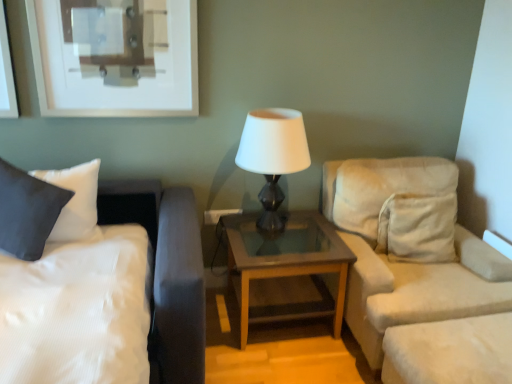
Question: From the image's perspective, is white glossy lamp at center located above or below beige fabric studio couch at right?

Choices:
 (A) below
 (B) above

Answer: (B)

Question: In terms of size, does white glossy lamp at center appear bigger or smaller than beige fabric studio couch at right?

Choices:
 (A) small
 (B) big

Answer: (A)

Question: Which of these objects is positioned closest to the satin white bed at left?

Choices:
 (A) white glossy lamp at center
 (B) beige fabric studio couch at right
 (C) matte black pillow at left
 (D) brown wood/glass table at center

Answer: (C)

Question: Estimate the real-world distances between objects in this image. Which object is closer to the brown wood/glass table at center?

Choices:
 (A) white glossy lamp at center
 (B) beige fabric studio couch at right
 (C) matte black pillow at left
 (D) satin white bed at left

Answer: (B)